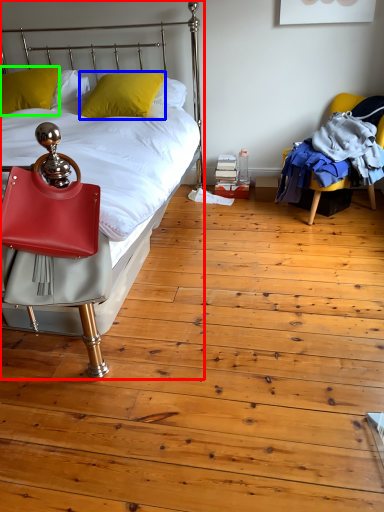
Question: Estimate the real-world distances between objects in this image. Which object is closer to bed (highlighted by a red box), pillow (highlighted by a blue box) or pillow (highlighted by a green box)?

Choices:
 (A) pillow
 (B) pillow

Answer: (A)